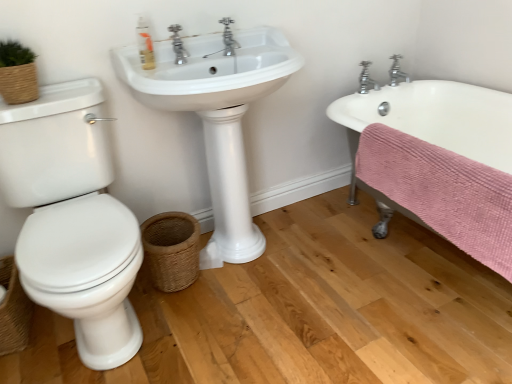
Where is `space that is in front of white glossy sink at center`? Image resolution: width=512 pixels, height=384 pixels. space that is in front of white glossy sink at center is located at coordinates (275, 328).